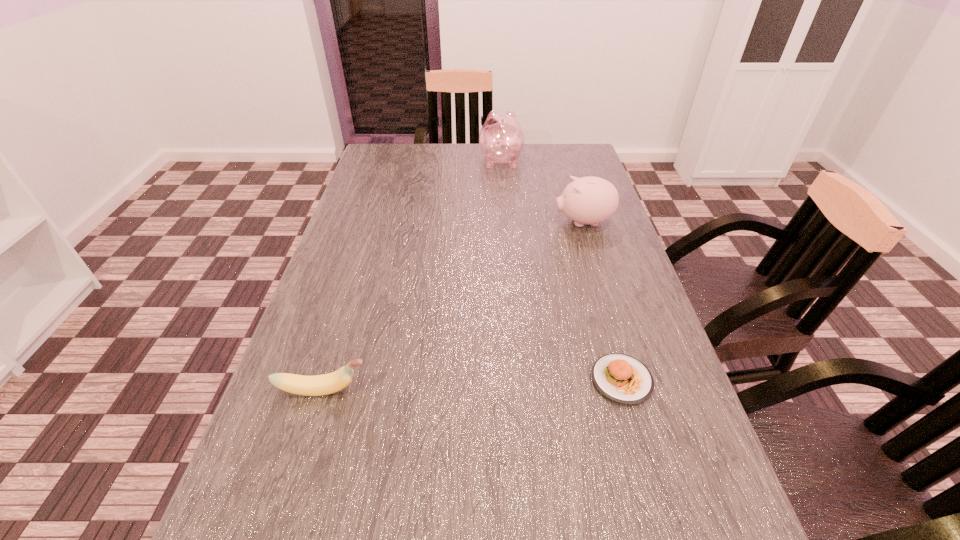
Find the location of a particular element. This screenshot has height=540, width=960. empty space between the third tallest object and the shortest object is located at coordinates (472, 385).

Find the location of a particular element. blank region between the nearer piggy bank and the shortest object is located at coordinates (603, 301).

Where is `free space between the shortest object and the second shortest object`? The height and width of the screenshot is (540, 960). free space between the shortest object and the second shortest object is located at coordinates (472, 385).

At what (x,y) coordinates should I click in order to perform the action: click on vacant point located between the nearer piggy bank and the leftmost object. Please return your answer as a coordinate pair (x, y). This screenshot has height=540, width=960. Looking at the image, I should click on (453, 306).

At what (x,y) coordinates should I click in order to perform the action: click on unoccupied position between the third tallest object and the food. Please return your answer as a coordinate pair (x, y). This screenshot has height=540, width=960. Looking at the image, I should click on (472, 385).

Locate an element on the screen. The width and height of the screenshot is (960, 540). vacant space that's between the second shortest object and the shortest object is located at coordinates (472, 385).

This screenshot has width=960, height=540. What are the coordinates of `empty space between the banana and the shortest object` in the screenshot? It's located at (472, 385).

Where is `vacant region between the food and the leftmost object`? Image resolution: width=960 pixels, height=540 pixels. vacant region between the food and the leftmost object is located at coordinates (472, 385).

At what (x,y) coordinates should I click in order to perform the action: click on vacant area between the food and the second object from left to right. Please return your answer as a coordinate pair (x, y). The height and width of the screenshot is (540, 960). Looking at the image, I should click on [562, 270].

This screenshot has width=960, height=540. What are the coordinates of `empty location between the leftmost object and the second farthest object` in the screenshot? It's located at (453, 306).